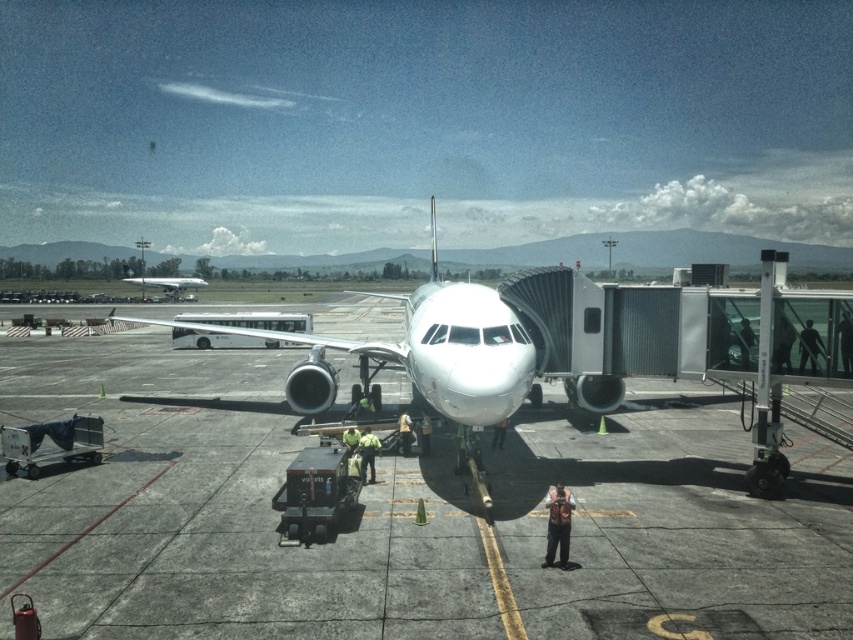
Question: Is metallic silver airplane at center below silver metallic airplane at center?

Choices:
 (A) no
 (B) yes

Answer: (B)

Question: Among these points, which one is nearest to the camera?

Choices:
 (A) (180, 454)
 (B) (183, 280)
 (C) (483, 285)

Answer: (A)

Question: Which of the following is the farthest from the observer?

Choices:
 (A) (183, 531)
 (B) (277, 339)
 (C) (189, 280)

Answer: (C)

Question: Does gray concrete tarmac at center appear on the left side of metallic silver airplane at center?

Choices:
 (A) yes
 (B) no

Answer: (B)

Question: Which is farther from the silver metallic airplane at center?

Choices:
 (A) metallic silver airplane at center
 (B) gray concrete tarmac at center

Answer: (B)

Question: Can you confirm if metallic silver airplane at center is positioned below silver metallic airplane at center?

Choices:
 (A) no
 (B) yes

Answer: (B)